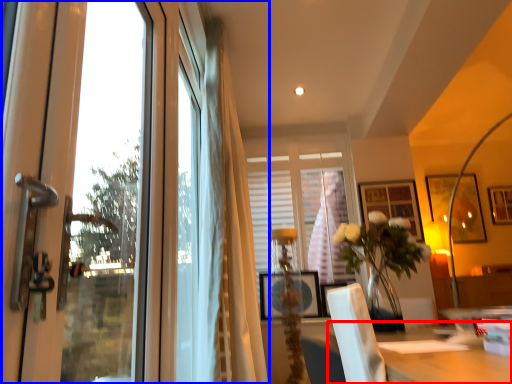
Question: Which object is further to the camera taking this photo, table (highlighted by a red box) or window (highlighted by a blue box)?

Choices:
 (A) table
 (B) window

Answer: (B)